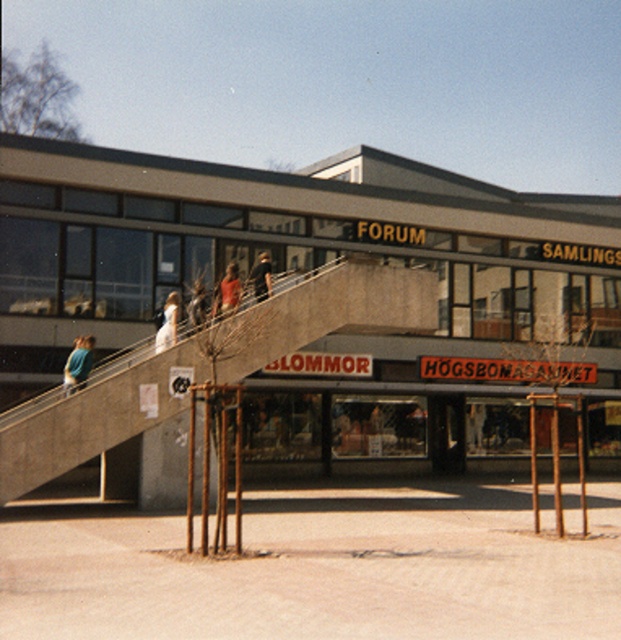
Question: Which of the following is the closest to the observer?

Choices:
 (A) (181, 378)
 (B) (84, 365)
 (C) (156, 332)

Answer: (B)

Question: Which point is farther to the camera?

Choices:
 (A) (88, 296)
 (B) (235, 292)
 (C) (58, 403)
 (D) (255, 298)

Answer: (A)

Question: Is concrete escalator at center to the right of matte black shirt at upper center from the viewer's perspective?

Choices:
 (A) yes
 (B) no

Answer: (A)

Question: Is concrete escalator at center thinner than orange fabric shirt at upper center?

Choices:
 (A) no
 (B) yes

Answer: (A)

Question: Does concrete escalator at center come behind orange fabric shirt at upper center?

Choices:
 (A) yes
 (B) no

Answer: (B)

Question: Based on their relative distances, which object is farther from the orange fabric shirt at upper center?

Choices:
 (A) blue fabric shirt at lower left
 (B) concrete escalator at center
 (C) white dress at upper center
 (D) concrete building at center

Answer: (D)